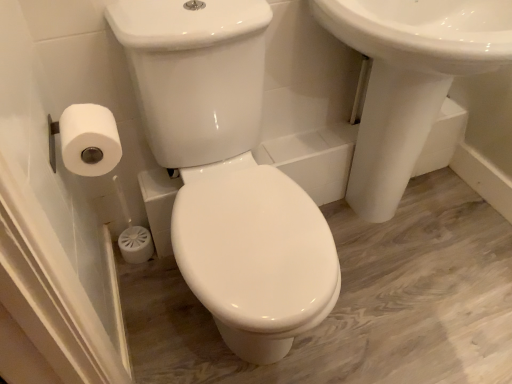
What do you see at coordinates (227, 172) in the screenshot? I see `white glossy toilet at center` at bounding box center [227, 172].

This screenshot has height=384, width=512. Identify the location of white matte toilet paper at left. (89, 139).

Describe the element at coordinates (409, 79) in the screenshot. I see `white glossy sink at upper right` at that location.

Measure the distance between white glossy sink at upper right and camera.

The depth of white glossy sink at upper right is 31.78 inches.

Where is `white glossy toilet at center`? Image resolution: width=512 pixels, height=384 pixels. white glossy toilet at center is located at coordinates (227, 172).

Visually, is white glossy toilet at center positioned to the left or to the right of white matte toilet paper at left?

white glossy toilet at center is positioned on white matte toilet paper at left's right side.

From the image's perspective, which object appears higher, white glossy toilet at center or white matte toilet paper at left?

white matte toilet paper at left, from the image's perspective.

Between white glossy toilet at center and white matte toilet paper at left, which one has smaller width?

white matte toilet paper at left is thinner.

From the image's perspective, is white matte toilet paper at left on white glossy sink at upper right?

No.

Can you confirm if white matte toilet paper at left is bigger than white glossy sink at upper right?

No.

Choose the correct answer: Is white matte toilet paper at left inside white glossy sink at upper right or outside it?

white matte toilet paper at left is not inside white glossy sink at upper right, it's outside.

Considering the positions of points (84, 125) and (415, 83), is point (84, 125) closer to camera compared to point (415, 83)?

Yes, point (84, 125) is in front of point (415, 83).

From the image's perspective, who appears lower, white glossy sink at upper right or white matte toilet paper at left?

From the image's view, white matte toilet paper at left is below.

Looking at their sizes, would you say white glossy sink at upper right is wider or thinner than white matte toilet paper at left?

Clearly, white glossy sink at upper right has more width compared to white matte toilet paper at left.

Which is correct: white glossy sink at upper right is inside white matte toilet paper at left, or outside of it?

white glossy sink at upper right is spatially situated outside white matte toilet paper at left.

At what (x,y) coordinates should I click in order to perform the action: click on sink on the right of white matte toilet paper at left. Please return your answer as a coordinate pair (x, y). This screenshot has width=512, height=384. Looking at the image, I should click on (409, 79).

Would you say white glossy toilet at center is part of white glossy sink at upper right's contents?

No, white glossy toilet at center is not a part of white glossy sink at upper right.

Which of these two, white glossy sink at upper right or white glossy toilet at center, is thinner?

white glossy sink at upper right is thinner.

From the image's perspective, relative to white glossy toilet at center, is white glossy sink at upper right above or below?

Clearly, from the image's perspective, white glossy sink at upper right is above white glossy toilet at center.

Are white glossy sink at upper right and white glossy toilet at center beside each other?

white glossy sink at upper right is not next to white glossy toilet at center, and they're not touching.

Looking at this image, is white glossy toilet at center wider than white glossy sink at upper right?

Indeed, white glossy toilet at center has a greater width compared to white glossy sink at upper right.

Considering their positions, is white glossy toilet at center located in front of or behind white glossy sink at upper right?

Clearly, white glossy toilet at center is in front of white glossy sink at upper right.

Considering the sizes of objects white glossy toilet at center and white glossy sink at upper right in the image provided, who is taller, white glossy toilet at center or white glossy sink at upper right?

Standing taller between the two is white glossy toilet at center.

From the picture: Considering the positions of objects white glossy toilet at center and white glossy sink at upper right in the image provided, who is more to the left, white glossy toilet at center or white glossy sink at upper right?

From the viewer's perspective, white glossy toilet at center appears more on the left side.

Which of these two, white matte toilet paper at left or white glossy toilet at center, is smaller?

Smaller between the two is white matte toilet paper at left.

Is white matte toilet paper at left inside or outside of white glossy toilet at center?

white matte toilet paper at left is located beyond the bounds of white glossy toilet at center.

I want to click on porcelain in front of the white matte toilet paper at left, so click(227, 172).

Find the location of `toilet paper that is on the left side of white glossy sink at upper right`. toilet paper that is on the left side of white glossy sink at upper right is located at coordinates pyautogui.click(x=89, y=139).

From the picture: When comparing their distances from white glossy sink at upper right, does white glossy toilet at center or white matte toilet paper at left seem closer?

white glossy toilet at center.

In the scene shown: Estimate the real-world distances between objects in this image. Which object is closer to white glossy toilet at center, white matte toilet paper at left or white glossy sink at upper right?

white matte toilet paper at left is closer to white glossy toilet at center.

Considering their positions, is white glossy toilet at center positioned closer to white matte toilet paper at left than white glossy sink at upper right?

Among the two, white glossy toilet at center is located nearer to white matte toilet paper at left.

Based on their spatial positions, is white glossy sink at upper right or white matte toilet paper at left further from white glossy toilet at center?

Result: white glossy sink at upper right is further to white glossy toilet at center.

Considering their positions, is white glossy sink at upper right positioned further to white matte toilet paper at left than white glossy toilet at center?

The object further to white matte toilet paper at left is white glossy sink at upper right.

Looking at this image, considering their positions, is white matte toilet paper at left positioned closer to white glossy sink at upper right than white glossy toilet at center?

The object closer to white glossy sink at upper right is white glossy toilet at center.

Where is `porcelain situated between white matte toilet paper at left and white glossy sink at upper right from left to right`? The width and height of the screenshot is (512, 384). porcelain situated between white matte toilet paper at left and white glossy sink at upper right from left to right is located at coordinates (227, 172).